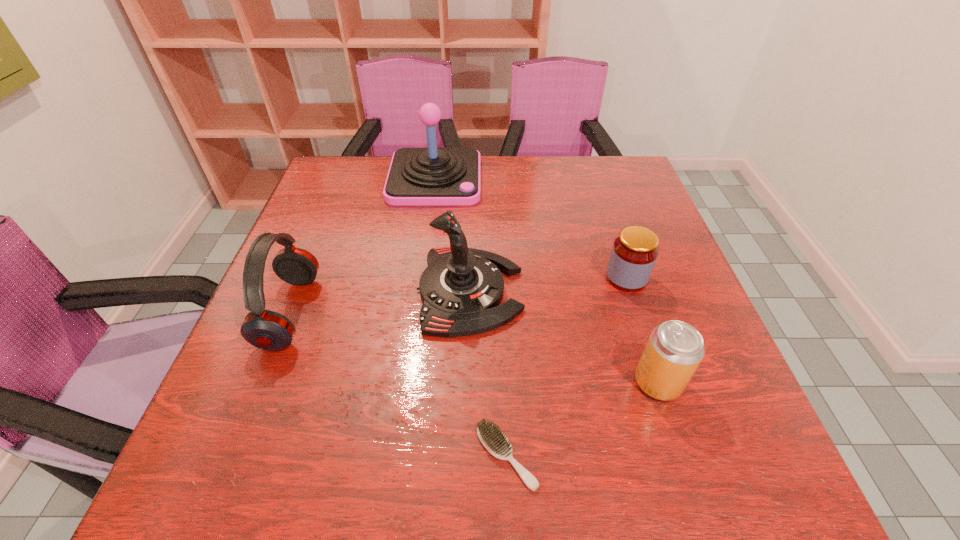
Where is `free region located on the left of the pop (soda)`? The height and width of the screenshot is (540, 960). free region located on the left of the pop (soda) is located at coordinates (449, 382).

Locate an element on the screen. The width and height of the screenshot is (960, 540). vacant space located 0.340m on the back of the jar is located at coordinates (595, 183).

The height and width of the screenshot is (540, 960). What are the coordinates of `vacant space situated 0.270m on the right of the scrubbing brush` in the screenshot? It's located at (704, 456).

This screenshot has height=540, width=960. What are the coordinates of `object situated at the far edge` in the screenshot? It's located at (432, 176).

Where is `object that is at the near edge`? object that is at the near edge is located at coordinates (493, 439).

Where is `object that is at the left edge`? Image resolution: width=960 pixels, height=540 pixels. object that is at the left edge is located at coordinates (268, 330).

Locate an element on the screen. Image resolution: width=960 pixels, height=540 pixels. pop (soda) located at the right edge is located at coordinates (674, 350).

This screenshot has width=960, height=540. In order to click on jar that is at the right edge in this screenshot , I will do `click(634, 253)`.

Find the location of a particular element. This screenshot has width=960, height=540. free location at the far edge is located at coordinates (572, 163).

Where is `free region at the near edge of the desktop`? free region at the near edge of the desktop is located at coordinates (463, 478).